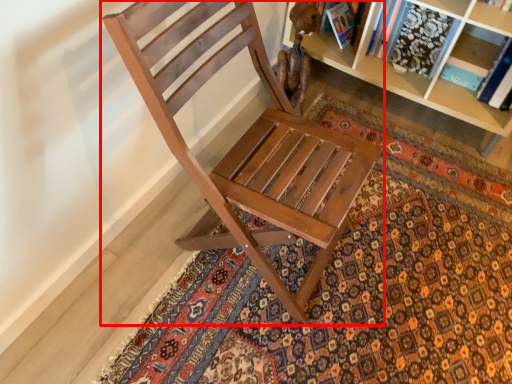
Question: From the image's perspective, considering the relative positions of chair (annotated by the red box) and doormat in the image provided, where is chair (annotated by the red box) located with respect to the staircase?

Choices:
 (A) above
 (B) below

Answer: (A)